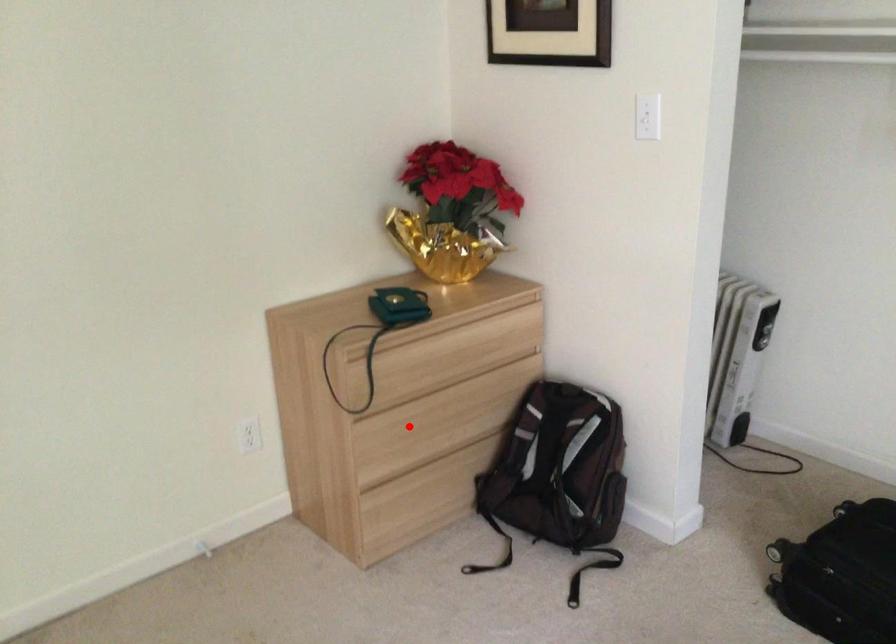
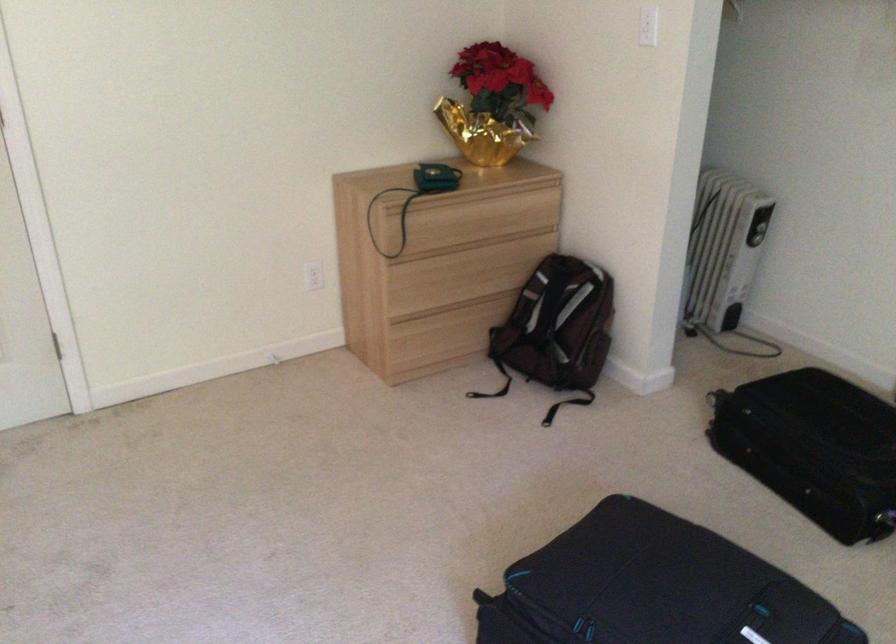
Question: I am providing you with two images of the same scene from different viewpoints. A red point is shown in image1. For the corresponding object point in image2, is it positioned nearer or farther from the camera?

Choices:
 (A) Nearer
 (B) Farther

Answer: (B)